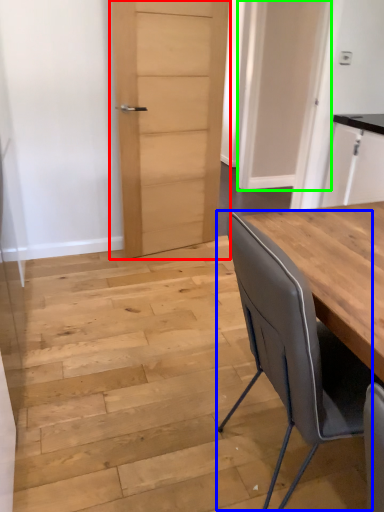
Question: Which is farther away from door (highlighted by a red box)? chair (highlighted by a blue box) or door (highlighted by a green box)?

Choices:
 (A) chair
 (B) door

Answer: (A)